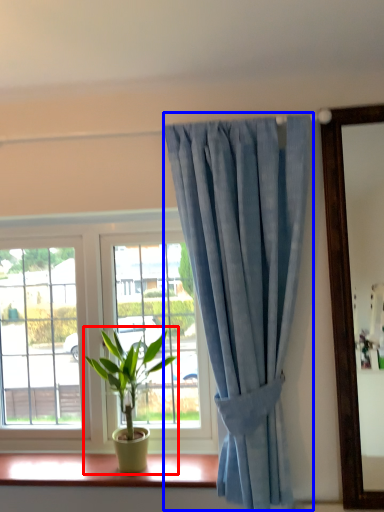
Question: Which point is closer to the camera, houseplant (highlighted by a red box) or curtain (highlighted by a blue box)?

Choices:
 (A) houseplant
 (B) curtain

Answer: (B)